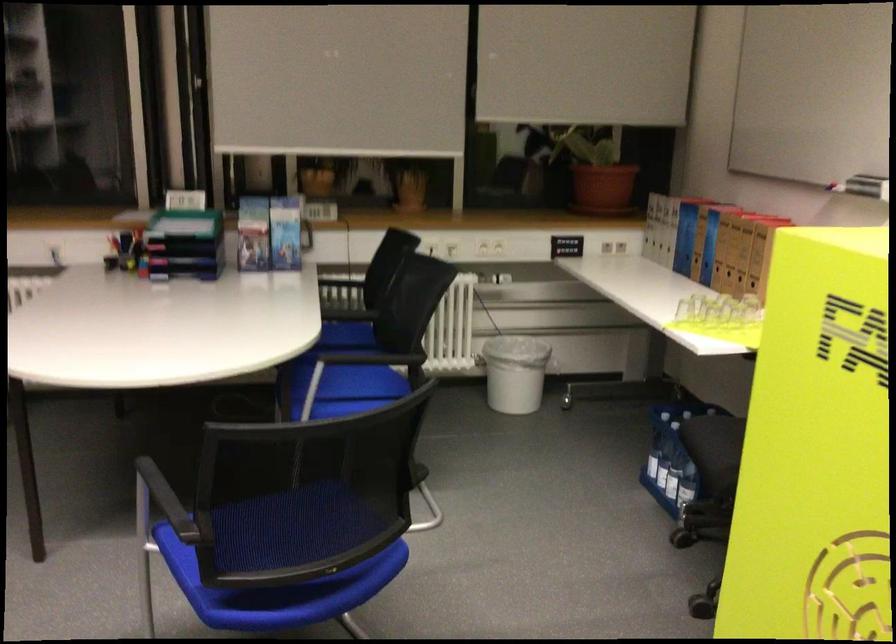
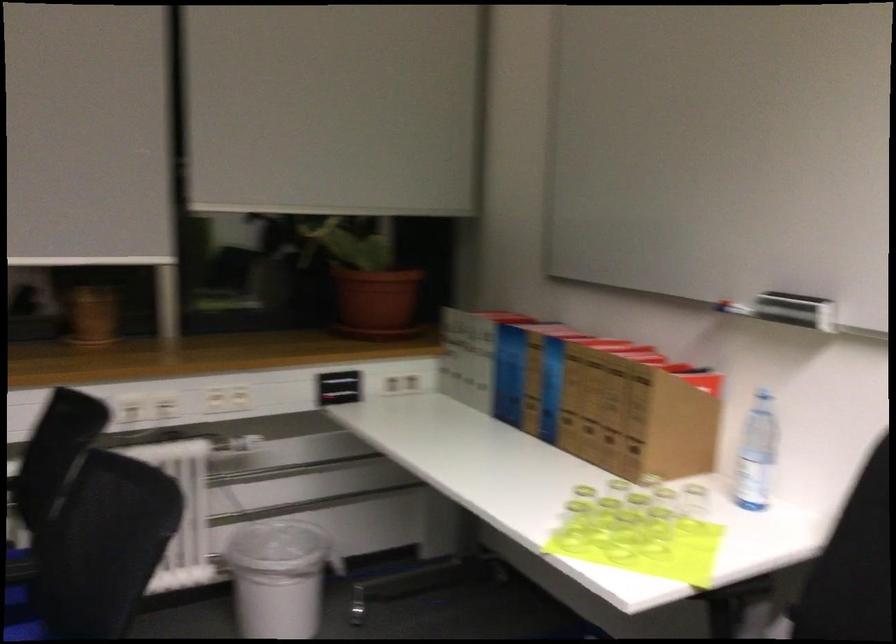
Where in the second image is the point corresponding to (686,236) from the first image?

(509, 374)